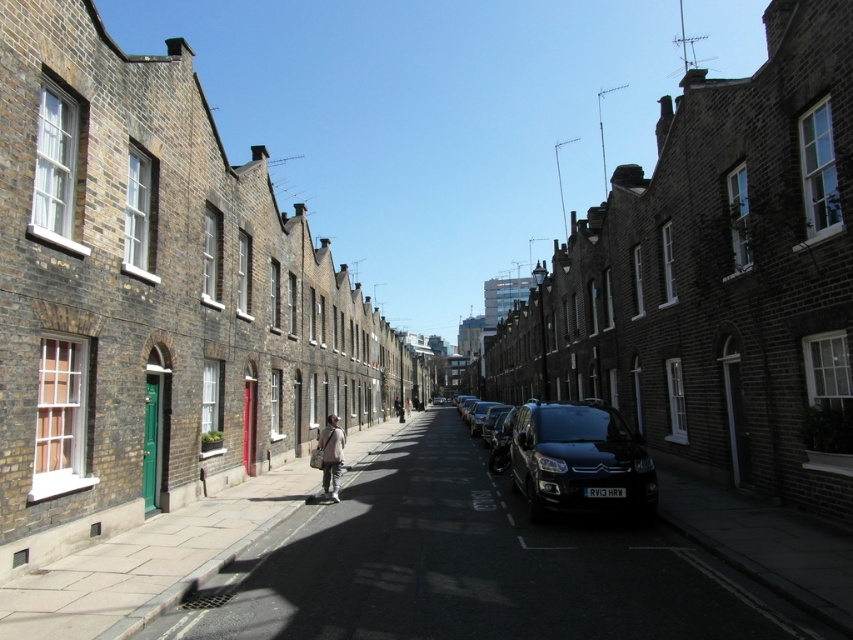
Can you confirm if dark gray concrete pavement at center is positioned to the right of shiny black van at center?

Incorrect, dark gray concrete pavement at center is not on the right side of shiny black van at center.

Based on the photo, who is positioned more to the left, dark gray concrete pavement at center or shiny black van at center?

Positioned to the left is dark gray concrete pavement at center.

What do you see at coordinates (471, 566) in the screenshot? I see `dark gray concrete pavement at center` at bounding box center [471, 566].

Identify the location of dark gray concrete pavement at center. (471, 566).

Is dark gray concrete pavement at center closer to camera compared to light beige fabric jacket at center?

That is True.

Who is taller, dark gray concrete pavement at center or light beige fabric jacket at center?

light beige fabric jacket at center is taller.

Between point (426, 516) and point (318, 449), which one is positioned behind?

Point (318, 449)

Where is `dark gray concrete pavement at center`? The height and width of the screenshot is (640, 853). dark gray concrete pavement at center is located at coordinates (471, 566).

Who is higher up, shiny black van at center or light beige fabric jacket at center?

shiny black van at center is above.

Does shiny black van at center have a greater height compared to light beige fabric jacket at center?

In fact, shiny black van at center may be shorter than light beige fabric jacket at center.

Does point (608, 445) come behind point (341, 461)?

No, (608, 445) is in front of (341, 461).

You are a GUI agent. You are given a task and a screenshot of the screen. Output one action in this format:
    pyautogui.click(x=<x>, y=<y>)
    Task: Click on the shiny black van at center
    The image size is (853, 640).
    Given the screenshot: What is the action you would take?
    pyautogui.click(x=579, y=460)